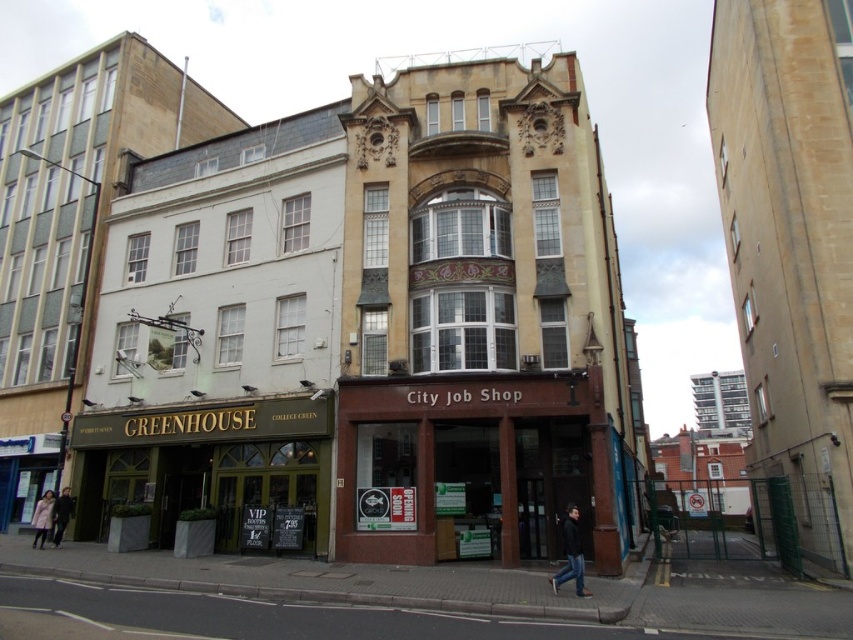
Can you confirm if brown wooden city job shop at center is taller than dark blue jacket at lower right?

Yes.

Does brown wooden city job shop at center have a lesser height compared to dark blue jacket at lower right?

No, brown wooden city job shop at center is not shorter than dark blue jacket at lower right.

The height and width of the screenshot is (640, 853). What are the coordinates of `brown wooden city job shop at center` in the screenshot? It's located at (482, 465).

Locate an element on the screen. This screenshot has width=853, height=640. brown wooden city job shop at center is located at coordinates (482, 465).